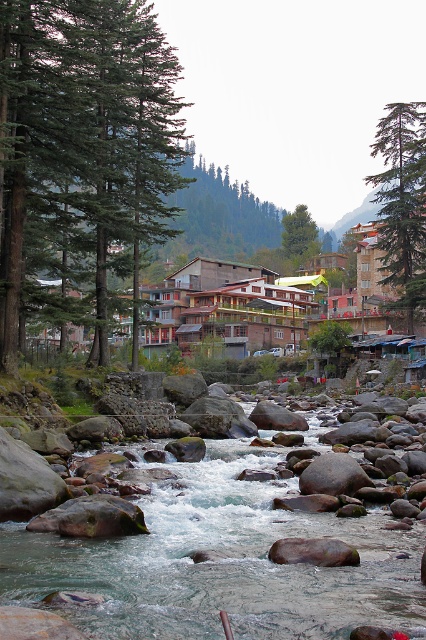
Between smooth rock river at center and green matte tree at upper right, which one has more height?

With more height is green matte tree at upper right.

Is smooth rock river at center taller than green matte tree at upper right?

Incorrect, smooth rock river at center's height is not larger of green matte tree at upper right's.

The image size is (426, 640). What do you see at coordinates (221, 563) in the screenshot?
I see `smooth rock river at center` at bounding box center [221, 563].

At what (x,y) coordinates should I click in order to perform the action: click on smooth rock river at center. Please return your answer as a coordinate pair (x, y). Image resolution: width=426 pixels, height=640 pixels. Looking at the image, I should click on coord(221,563).

Which is behind, point (74, 76) or point (423, 106)?

The point (423, 106) is more distant.

Is green evergreen trees at left shorter than green matte tree at upper right?

Yes.

Between point (48, 209) and point (417, 136), which one is positioned behind?

The point (417, 136) is behind.

Where is `green evergreen trees at left`? This screenshot has width=426, height=640. green evergreen trees at left is located at coordinates (81, 152).

Who is positioned more to the right, green evergreen trees at left or smooth rock river at center?

smooth rock river at center

Can you confirm if green evergreen trees at left is shorter than smooth rock river at center?

No.

What are the coordinates of `green evergreen trees at left` in the screenshot? It's located at (81, 152).

Identify the location of green evergreen trees at left. This screenshot has width=426, height=640. (81, 152).